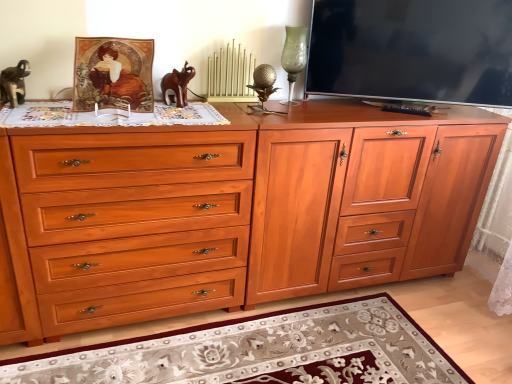
Question: Considering the relative sizes of shiny wood drawer at center and brown wooden elephant at center in the image provided, is shiny wood drawer at center shorter than brown wooden elephant at center?

Choices:
 (A) yes
 (B) no

Answer: (B)

Question: Is shiny wood drawer at center far away from brown wooden elephant at center?

Choices:
 (A) no
 (B) yes

Answer: (A)

Question: Is shiny wood drawer at center looking in the opposite direction of brown wooden elephant at center?

Choices:
 (A) no
 (B) yes

Answer: (A)

Question: Can you confirm if shiny wood drawer at center is thinner than brown wooden elephant at center?

Choices:
 (A) yes
 (B) no

Answer: (B)

Question: Could you tell me if shiny wood drawer at center is facing brown wooden elephant at center?

Choices:
 (A) no
 (B) yes

Answer: (A)

Question: Does shiny wood drawer at center lie in front of brown wooden elephant at center?

Choices:
 (A) no
 (B) yes

Answer: (B)

Question: Is brown wooden elephant at center looking in the opposite direction of floral rug at lower center?

Choices:
 (A) no
 (B) yes

Answer: (A)

Question: From a real-world perspective, is brown wooden elephant at center under floral rug at lower center?

Choices:
 (A) yes
 (B) no

Answer: (B)

Question: Can you confirm if brown wooden elephant at center is shorter than floral rug at lower center?

Choices:
 (A) no
 (B) yes

Answer: (A)

Question: Is brown wooden elephant at center directly adjacent to floral rug at lower center?

Choices:
 (A) no
 (B) yes

Answer: (A)

Question: From the image's perspective, is brown wooden elephant at center located beneath floral rug at lower center?

Choices:
 (A) yes
 (B) no

Answer: (B)

Question: Can you confirm if brown wooden elephant at center is wider than floral rug at lower center?

Choices:
 (A) yes
 (B) no

Answer: (B)

Question: From a real-world perspective, is matte black tv at upper right under brown wooden elephant at center?

Choices:
 (A) no
 (B) yes

Answer: (A)